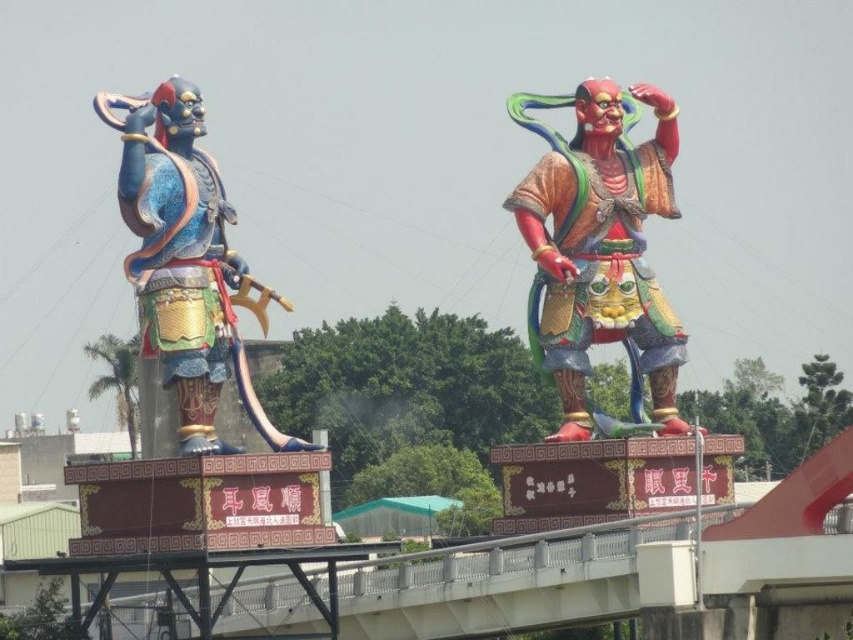
Question: Among these objects, which one is nearest to the camera?

Choices:
 (A) glossy painted statue at right
 (B) shiny blue armor at left

Answer: (B)

Question: Does glossy painted statue at right have a lesser width compared to shiny blue armor at left?

Choices:
 (A) no
 (B) yes

Answer: (B)

Question: Is glossy painted statue at right bigger than shiny blue armor at left?

Choices:
 (A) no
 (B) yes

Answer: (B)

Question: Is glossy painted statue at right below shiny blue armor at left?

Choices:
 (A) yes
 (B) no

Answer: (B)